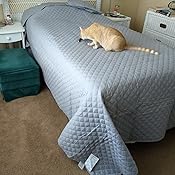
The width and height of the screenshot is (175, 175). I want to click on cat toy, so click(80, 40).